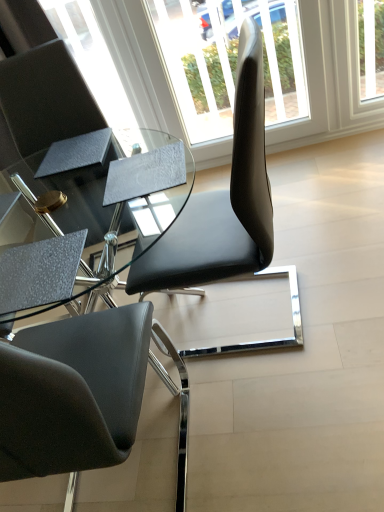
Question: Considering the positions of transparent glass window at center and matte black chair at upper left in the image, is transparent glass window at center bigger or smaller than matte black chair at upper left?

Choices:
 (A) small
 (B) big

Answer: (A)

Question: Is transparent glass window at center situated inside matte black chair at upper left or outside?

Choices:
 (A) inside
 (B) outside

Answer: (B)

Question: Visually, is transparent glass window at center positioned to the left or to the right of matte black chair at upper left?

Choices:
 (A) right
 (B) left

Answer: (A)

Question: From the image's perspective, relative to transparent glass window at center, is matte black chair at upper left above or below?

Choices:
 (A) above
 (B) below

Answer: (B)

Question: Is matte black chair at upper left bigger or smaller than transparent glass window at center?

Choices:
 (A) big
 (B) small

Answer: (A)

Question: In the image, is matte black chair at upper left positioned in front of or behind transparent glass window at center?

Choices:
 (A) behind
 (B) front

Answer: (B)

Question: Considering the positions of matte black chair at upper left and transparent glass window at center in the image, is matte black chair at upper left wider or thinner than transparent glass window at center?

Choices:
 (A) thin
 (B) wide

Answer: (B)